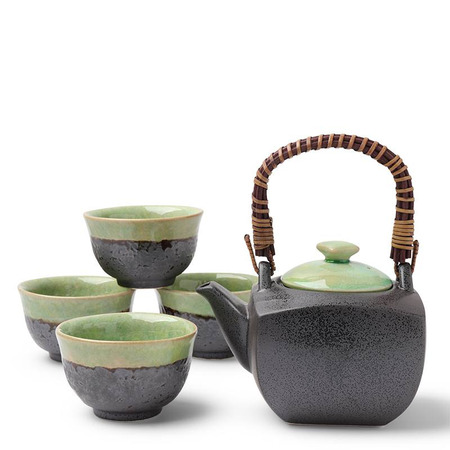
At what (x,y) coordinates should I click in order to perform the action: click on green top layer of cup. Please return your answer as a coordinate pair (x, y). The width and height of the screenshot is (450, 450). Looking at the image, I should click on (53, 308), (142, 233), (180, 299), (105, 349).